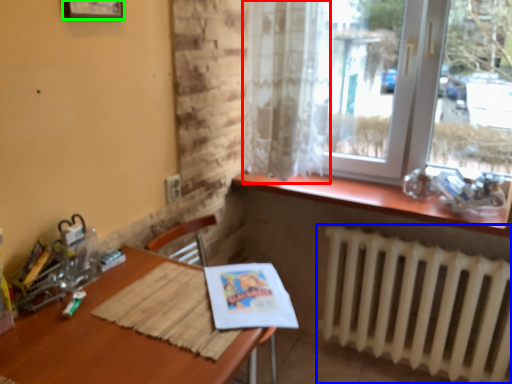
Question: Considering the real-world distances, which object is closest to curtain (highlighted by a red box)? radiator (highlighted by a blue box) or picture frame (highlighted by a green box).

Choices:
 (A) radiator
 (B) picture frame

Answer: (A)